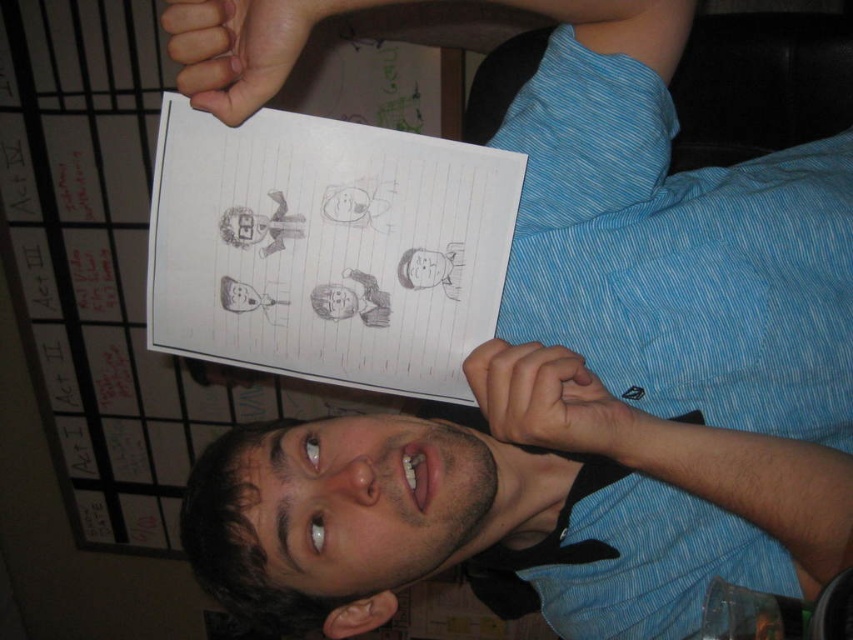
Is point (218, 596) in front of point (329, 246)?

That is False.

Which is behind, point (701, 512) or point (424, 212)?

The point (701, 512) is more distant.

In order to click on matte blue shirt at center in this screenshot , I will do point(498,499).

Who is positioned more to the left, matte blue shirt at center or dark brown hair at center?

From the viewer's perspective, dark brown hair at center appears more on the left side.

The width and height of the screenshot is (853, 640). I want to click on matte blue shirt at center, so pos(498,499).

How much distance is there between white lined paper at upper center and dark brown hair at center?

A distance of 5.16 inches exists between white lined paper at upper center and dark brown hair at center.

Who is higher up, white lined paper at upper center or dark brown hair at center?

white lined paper at upper center is higher up.

Where is `white lined paper at upper center`? The width and height of the screenshot is (853, 640). white lined paper at upper center is located at coordinates (326, 248).

Where is `white lined paper at upper center`? Image resolution: width=853 pixels, height=640 pixels. white lined paper at upper center is located at coordinates (326, 248).